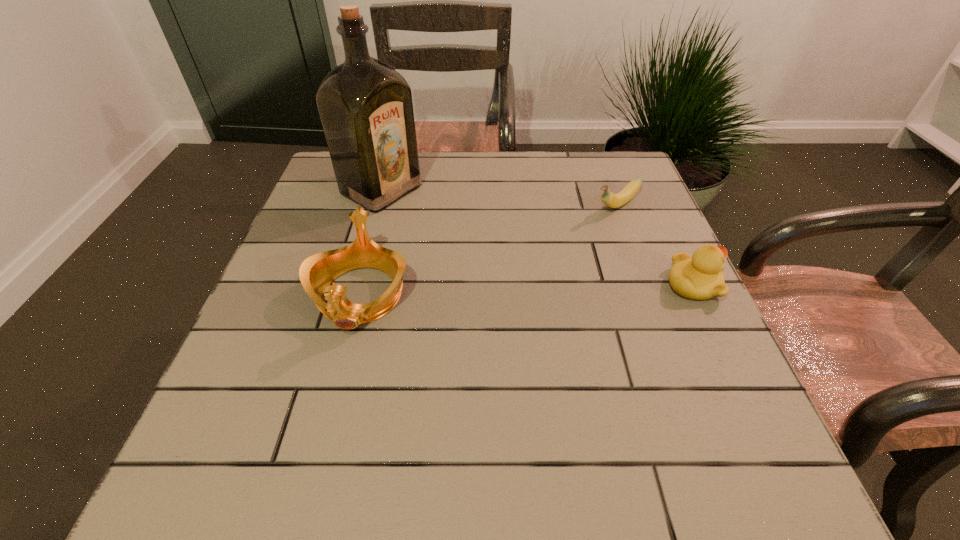
Identify the location of vacant space at the near edge of the desktop. (585, 397).

The image size is (960, 540). In the image, there is a desktop. Identify the location of blank space at the left edge. (328, 334).

Identify the location of vacant region at the right edge of the desktop. This screenshot has height=540, width=960. (665, 289).

You are a GUI agent. You are given a task and a screenshot of the screen. Output one action in this format:
    pyautogui.click(x=<x>, y=<y>)
    Task: Click on the vacant space at the far right corner of the desktop
    This screenshot has height=540, width=960.
    Given the screenshot: What is the action you would take?
    pyautogui.click(x=614, y=178)

The height and width of the screenshot is (540, 960). In order to click on empty location between the duckling and the banana in this screenshot , I will do `click(655, 245)`.

Locate an element on the screen. The width and height of the screenshot is (960, 540). vacant space in between the banana and the tallest object is located at coordinates (499, 198).

Identify the location of vacant area that lies between the duckling and the second tallest object. This screenshot has height=540, width=960. (526, 290).

Identify the location of empty location between the duckling and the banana. (655, 245).

Find the location of a particular element. The height and width of the screenshot is (540, 960). vacant area that lies between the banana and the tiara is located at coordinates (489, 250).

At what (x,y) coordinates should I click in order to perform the action: click on vacant space in between the liquor and the duckling. Please return your answer as a coordinate pair (x, y). Looking at the image, I should click on (537, 237).